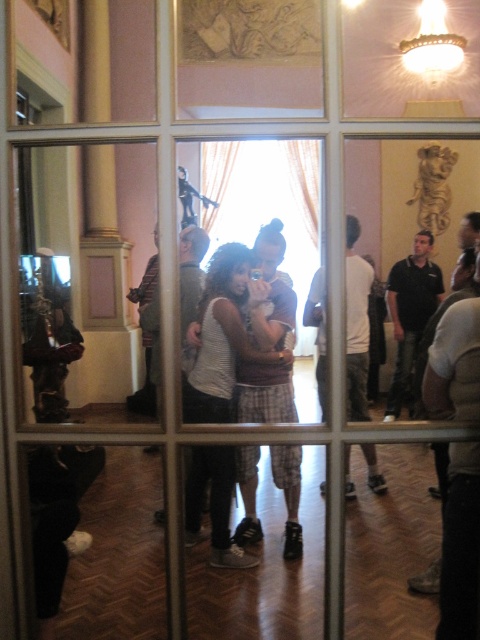
Question: Does striped fabric shirt at center have a smaller size compared to black cotton shirt at center?

Choices:
 (A) yes
 (B) no

Answer: (A)

Question: Which point is farther to the camera?

Choices:
 (A) white cotton shirt at center
 (B) striped fabric shirt at center

Answer: (A)

Question: Is white cotton shirt at center to the left of black cotton shirt at center from the viewer's perspective?

Choices:
 (A) no
 (B) yes

Answer: (B)

Question: Which point is closer to the camera?

Choices:
 (A) black cotton shirt at center
 (B) white cotton shirt at center
 (C) striped fabric shirt at center

Answer: (C)

Question: Observing the image, what is the correct spatial positioning of striped fabric shirt at center in reference to black cotton shirt at center?

Choices:
 (A) below
 (B) above

Answer: (A)

Question: Which object is positioned farthest from the white cotton shirt at center?

Choices:
 (A) striped fabric shirt at center
 (B) black cotton shirt at center

Answer: (B)